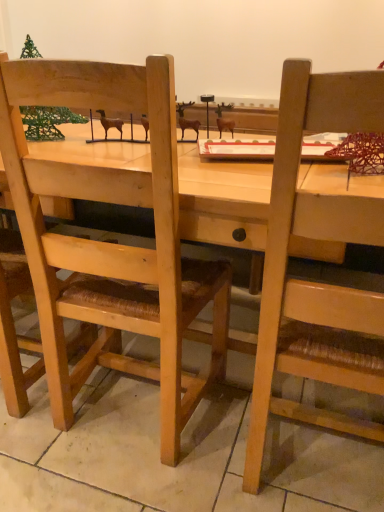
What are the coordinates of `free space in front of green wire christmas tree at upper left` in the screenshot? It's located at (51, 148).